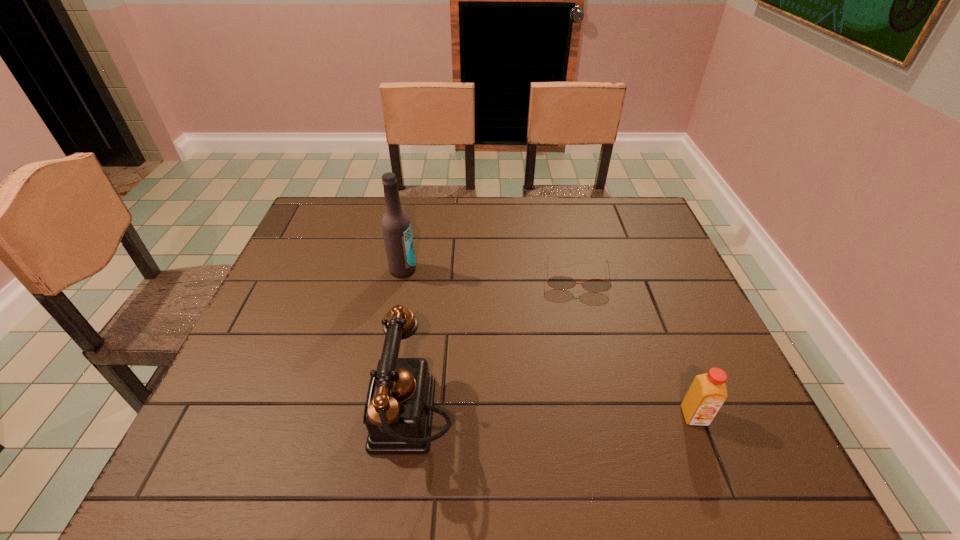
I want to click on free space on the desktop that is between the telephone and the third tallest object and is positioned on the label of the tallest object, so click(573, 417).

Find the location of a particular element. vacant space on the desktop that is between the second tallest object and the third tallest object and is positioned on the face of the shortest object is located at coordinates (585, 417).